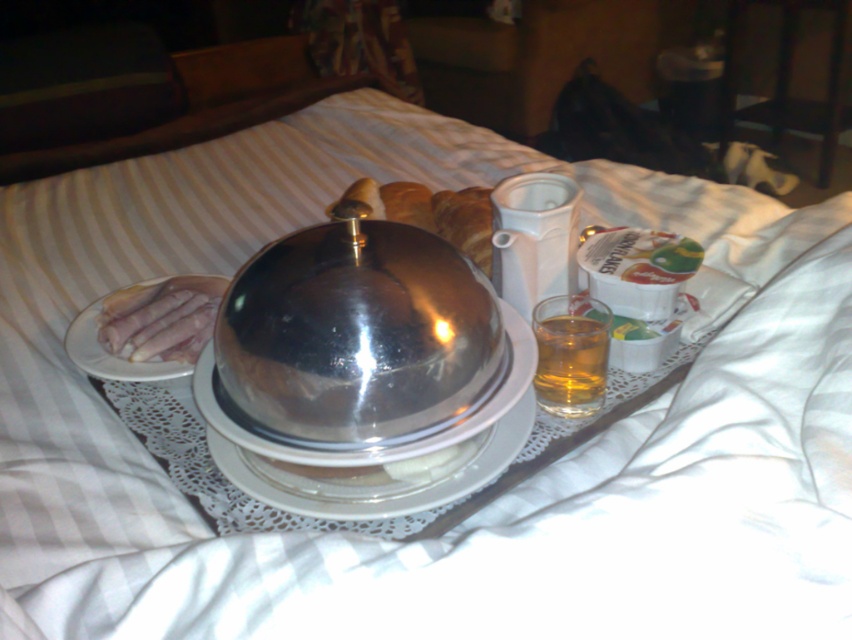
Question: Can you confirm if clear glass plate at center is positioned to the right of translucent glass cup at center?

Choices:
 (A) no
 (B) yes

Answer: (A)

Question: Which point is farther to the camera?

Choices:
 (A) (176, 355)
 (B) (538, 387)

Answer: (A)

Question: Can you confirm if clear glass plate at center is bigger than translucent glass cup at center?

Choices:
 (A) yes
 (B) no

Answer: (A)

Question: Which object appears farthest from the camera in this image?

Choices:
 (A) clear glass plate at center
 (B) pinkish raw meat at left

Answer: (B)

Question: Considering the relative positions of clear glass plate at center and pinkish raw meat at left in the image provided, where is clear glass plate at center located with respect to pinkish raw meat at left?

Choices:
 (A) right
 (B) left

Answer: (A)

Question: Estimate the real-world distances between objects in this image. Which object is closer to the translucent glass cup at center?

Choices:
 (A) clear glass plate at center
 (B) pinkish raw meat at left

Answer: (A)